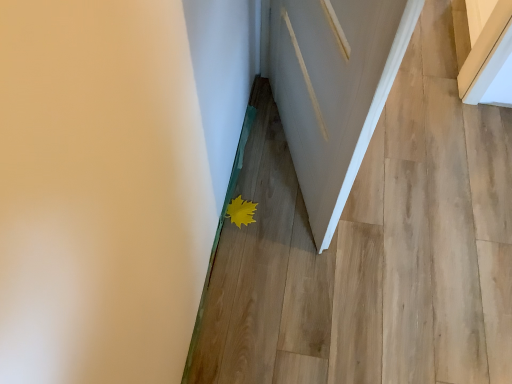
Question: Is the depth of yellow matte leaf at lower center less than that of matte white door at lower center?

Choices:
 (A) yes
 (B) no

Answer: (B)

Question: Considering the relative sizes of yellow matte leaf at lower center and matte white door at lower center in the image provided, is yellow matte leaf at lower center shorter than matte white door at lower center?

Choices:
 (A) no
 (B) yes

Answer: (B)

Question: From the image's perspective, does yellow matte leaf at lower center appear lower than matte white door at lower center?

Choices:
 (A) no
 (B) yes

Answer: (B)

Question: Considering the relative sizes of yellow matte leaf at lower center and matte white door at lower center in the image provided, is yellow matte leaf at lower center bigger than matte white door at lower center?

Choices:
 (A) no
 (B) yes

Answer: (A)

Question: Considering the relative sizes of yellow matte leaf at lower center and matte white door at lower center in the image provided, is yellow matte leaf at lower center smaller than matte white door at lower center?

Choices:
 (A) yes
 (B) no

Answer: (A)

Question: From a real-world perspective, is yellow matte leaf at lower center on matte white door at lower center?

Choices:
 (A) no
 (B) yes

Answer: (B)

Question: Does yellow matte leaf at lower center have a larger size compared to white wood door at center?

Choices:
 (A) yes
 (B) no

Answer: (B)

Question: Does yellow matte leaf at lower center appear on the right side of white wood door at center?

Choices:
 (A) no
 (B) yes

Answer: (A)

Question: Can you confirm if yellow matte leaf at lower center is wider than white wood door at center?

Choices:
 (A) yes
 (B) no

Answer: (B)

Question: Does yellow matte leaf at lower center contain white wood door at center?

Choices:
 (A) yes
 (B) no

Answer: (B)

Question: Does yellow matte leaf at lower center turn towards white wood door at center?

Choices:
 (A) no
 (B) yes

Answer: (B)

Question: From the image's perspective, is yellow matte leaf at lower center on white wood door at center?

Choices:
 (A) yes
 (B) no

Answer: (B)

Question: Is matte white door at lower center placed right next to yellow matte leaf at lower center?

Choices:
 (A) yes
 (B) no

Answer: (B)